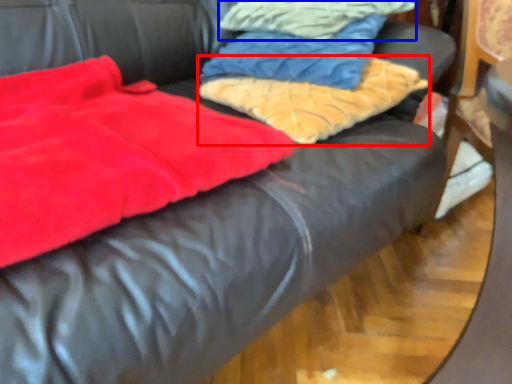
Question: Which object is closer to the camera taking this photo, cloth (highlighted by a red box) or cloth (highlighted by a blue box)?

Choices:
 (A) cloth
 (B) cloth

Answer: (A)